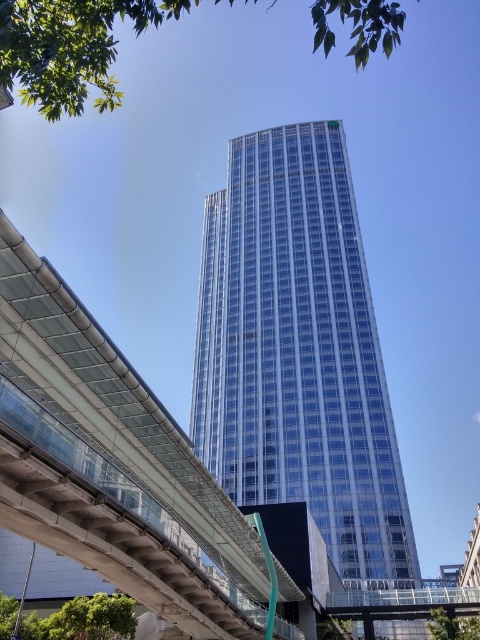
You are a city planner evaluating the proposed location of a new observation deck. The deck will be placed on the transparent glass tower at center. Considering the height of the green leafy tree at lower right, do you think the observation deck will provide a clear view of the surrounding area without obstruction?

The transparent glass tower at center is much taller than the green leafy tree at lower right, so the observation deck will have an unobstructed view of the surrounding area.

You are an architect reviewing the urban layout of the city. You notice the transparent glass tower at center and the green leafy tree at upper left. Which object is located higher in the image?

The green leafy tree at upper left is higher in the image because the transparent glass tower at center is positioned under it.

You are standing at the base of the transparent glass tower at center. If you look directly upward, will you see the sky or the overpass?

Since the transparent glass tower at center is located at point (298,349), which is below the overpass, looking directly upward from its base would show the sky, not the overpass.